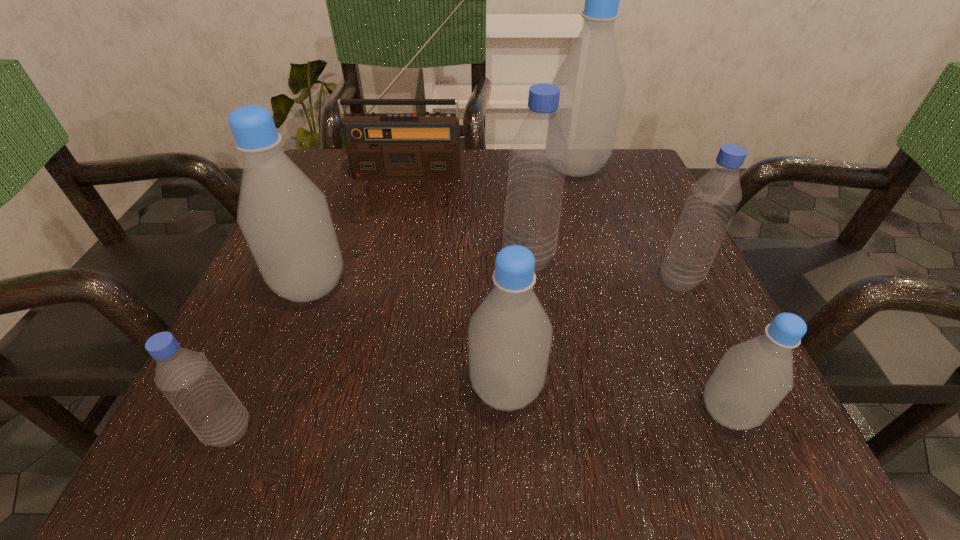
You are a GUI agent. You are given a task and a screenshot of the screen. Output one action in this format:
    pyautogui.click(x=<x>, y=<y>)
    Task: Click on the free location at the far right corner
    
    Given the screenshot: What is the action you would take?
    point(601,192)

At what (x,y) coordinates should I click in order to perform the action: click on vacant region at the near right corner of the desktop. Please return your answer as a coordinate pair (x, y). Looking at the image, I should click on (791, 447).

In order to click on blank region between the radio receiver and the nearest blue bottle in this screenshot , I will do `click(322, 302)`.

This screenshot has height=540, width=960. Find the location of `vacant area between the second farthest gray bottle and the nearest blue bottle`. vacant area between the second farthest gray bottle and the nearest blue bottle is located at coordinates (271, 359).

At what (x,y) coordinates should I click in order to perform the action: click on vacant space that's between the smallest gray bottle and the second blue bottle from right to left. Please return your answer as a coordinate pair (x, y). This screenshot has width=960, height=540. Looking at the image, I should click on (628, 336).

Where is `vacant area that lies between the biggest blue bottle and the second smallest blue bottle`? vacant area that lies between the biggest blue bottle and the second smallest blue bottle is located at coordinates (604, 270).

Locate an element on the screen. vacant area that lies between the biggest gray bottle and the third nearest gray bottle is located at coordinates (444, 227).

Find the location of `vacant space in between the tallest bottle and the third biggest gray bottle`. vacant space in between the tallest bottle and the third biggest gray bottle is located at coordinates (540, 279).

The width and height of the screenshot is (960, 540). I want to click on empty space that is in between the rightmost blue bottle and the third gray bottle from right to left, so click(x=592, y=334).

Where is `free space between the smallest blue bottle and the second farthest gray bottle`? Image resolution: width=960 pixels, height=540 pixels. free space between the smallest blue bottle and the second farthest gray bottle is located at coordinates (271, 359).